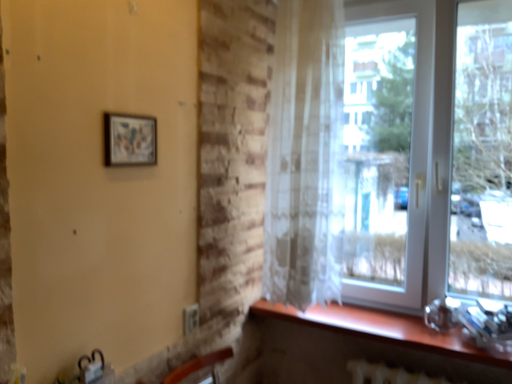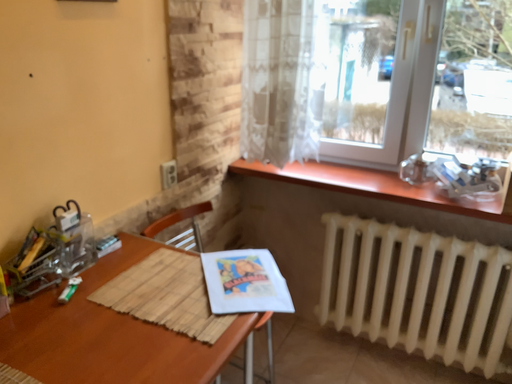
Question: How did the camera likely rotate when shooting the video?

Choices:
 (A) rotated downward
 (B) rotated upward

Answer: (A)